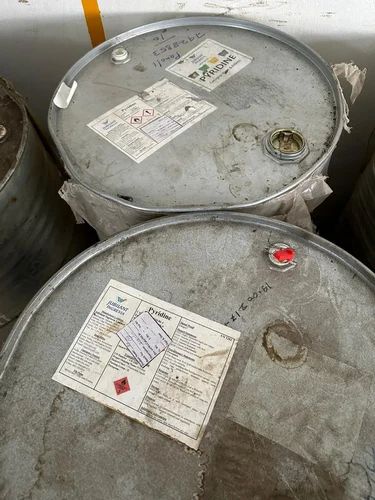
The height and width of the screenshot is (500, 375). Find the location of `red plug`. red plug is located at coordinates (282, 245).